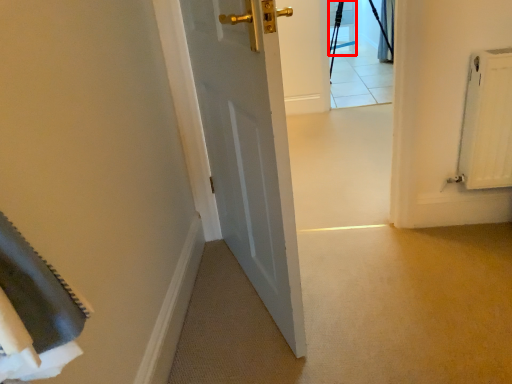
Question: Observing the image, what is the correct spatial positioning of chair (annotated by the red box) in reference to curtain?

Choices:
 (A) left
 (B) right

Answer: (A)